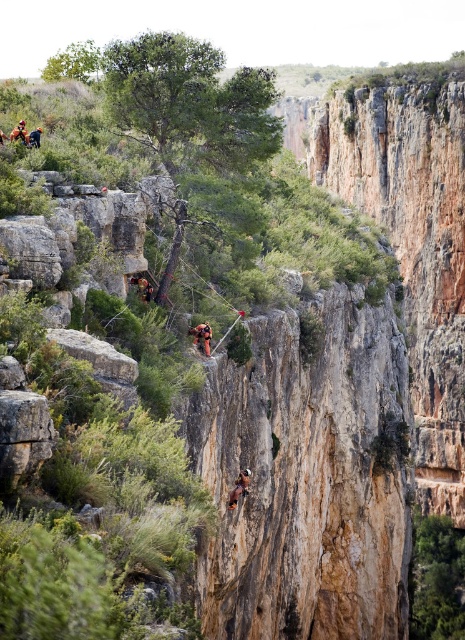
You are a safety inspector reviewing this climbing setup. You notice the camouflage fabric person at center and the camouflage fabric harness at center. Based on their sizes, is the harness appropriately sized for the climber?

The camouflage fabric person at center is larger in size compared to the camouflage fabric harness at center. This suggests the harness may be too small for the climber, posing a safety risk.

You are a hiker planning to climb the cliff. You see a camouflage fabric person at center marked by point (x=239, y=488). Is this point located on the cliff face?

Yes, the camouflage fabric person at center is represented by point (x=239, y=488), which indicates their position is on the cliff face.

Based on the photo, you are standing at the base of the cliff and see the camouflage fabric person at center. If you want to throw a rope to them, and the maximum distance you can throw is 50 meters, will you be able to reach them?

The camouflage fabric person at center is 171.83 feet away from you. Since 171.83 feet is approximately 52.37 meters, which exceeds your maximum throwing distance of 50 meters, you will not be able to reach them with a single throw.